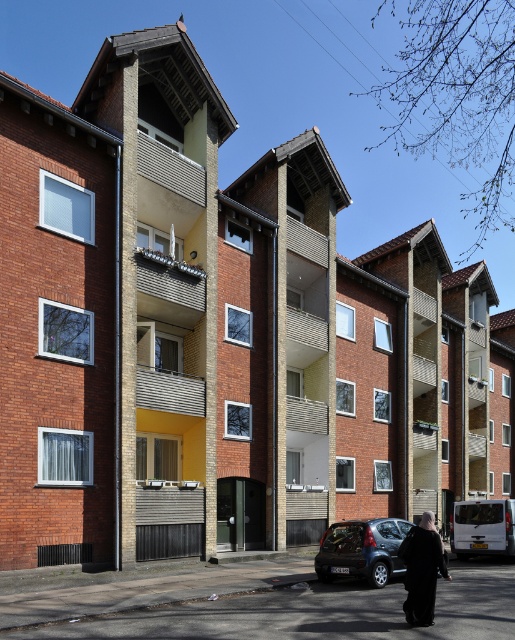
You are standing in front of the residential buildings and notice a dark gray metallic hatchback at lower center and a black matte coat at lower center. Which object is positioned closer to the ground?

The dark gray metallic hatchback at lower center is positioned closer to the ground since it is below the black matte coat at lower center.

You are a delivery person trying to park your dark gray metallic hatchback at lower center in a spot that requires vehicles to be under 5 feet tall. The black matte coat at lower center is currently hanging on a hook next to the parking spot. Can your vehicle fit in the spot based on their heights?

The dark gray metallic hatchback at lower center has a lesser height compared to the black matte coat at lower center. Since the coat is taller, the vehicle is under 5 feet tall and can fit in the parking spot.